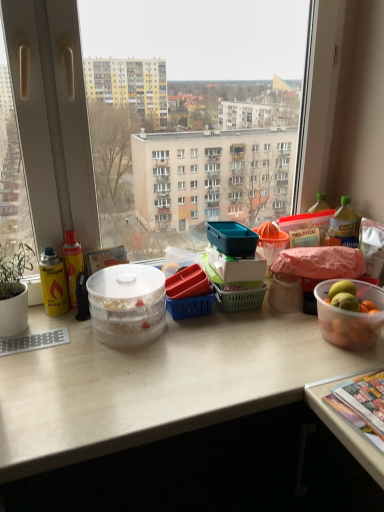
Question: Considering the relative sizes of translucent plastic bowl at right, acting as the 2th bowl starting from the left, and clear plastic bottle at right in the image provided, is translucent plastic bowl at right, acting as the 2th bowl starting from the left, bigger than clear plastic bottle at right?

Choices:
 (A) no
 (B) yes

Answer: (B)

Question: From the image's perspective, would you say translucent plastic bowl at right, which appears as the first bowl when viewed from the right, is positioned over clear plastic bottle at right?

Choices:
 (A) yes
 (B) no

Answer: (B)

Question: From a real-world perspective, does translucent plastic bowl at right, which appears as the first bowl when viewed from the right, stand above clear plastic bottle at right?

Choices:
 (A) yes
 (B) no

Answer: (B)

Question: Does translucent plastic bowl at right, which appears as the first bowl when viewed from the right, have a lesser height compared to clear plastic bottle at right?

Choices:
 (A) yes
 (B) no

Answer: (B)

Question: Can you confirm if translucent plastic bowl at right, acting as the 2th bowl starting from the left, is taller than clear plastic bottle at right?

Choices:
 (A) yes
 (B) no

Answer: (A)

Question: From the image's perspective, is translucent plastic bowl at right, acting as the 2th bowl starting from the left, beneath clear plastic bottle at right?

Choices:
 (A) no
 (B) yes

Answer: (B)

Question: From the image's perspective, does transparent plastic bowl at center, the second bowl from the right, appear lower than clear plastic bottle at right?

Choices:
 (A) yes
 (B) no

Answer: (A)

Question: Considering the relative positions of transparent plastic bowl at center, the second bowl from the right, and clear plastic bottle at right in the image provided, is transparent plastic bowl at center, the second bowl from the right, in front of clear plastic bottle at right?

Choices:
 (A) yes
 (B) no

Answer: (A)

Question: Does transparent plastic bowl at center, the second bowl from the right, have a greater height compared to clear plastic bottle at right?

Choices:
 (A) no
 (B) yes

Answer: (A)

Question: Considering the relative positions of transparent plastic bowl at center, the second bowl from the right, and clear plastic bottle at right in the image provided, is transparent plastic bowl at center, the second bowl from the right, behind clear plastic bottle at right?

Choices:
 (A) yes
 (B) no

Answer: (B)

Question: Can you confirm if transparent plastic bowl at center, the second bowl from the right, is thinner than clear plastic bottle at right?

Choices:
 (A) yes
 (B) no

Answer: (B)

Question: Can you confirm if transparent plastic bowl at center, the second bowl from the right, is smaller than clear plastic bottle at right?

Choices:
 (A) no
 (B) yes

Answer: (A)

Question: Can you confirm if translucent plastic bowl at right, acting as the 2th bowl starting from the left, is taller than multicolored glossy magazine at lower right?

Choices:
 (A) yes
 (B) no

Answer: (A)